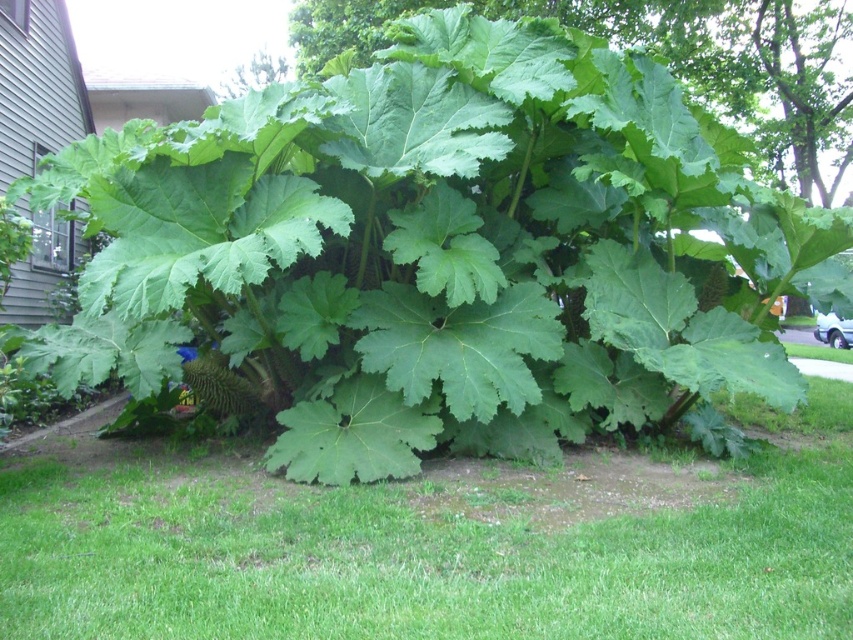
You are standing in a garden and see the green grass at center and the green leafy plant at center. Which one is more to the left?

The green grass at center is more to the left because it is positioned on the left side of the green leafy plant at center.

You are a gardener looking at the image. You need to determine which object at the center is narrower between the green grass at center and the green leafy plant at center. Which one is it?

The green grass at center is thinner than the green leafy plant at center, so the green grass at center is narrower.

From the picture: You are standing in a garden and see the green grass at center and the green leafy plant at center. Which one is closer to you?

The green grass at center is closer to you because it is in front of the green leafy plant at center.